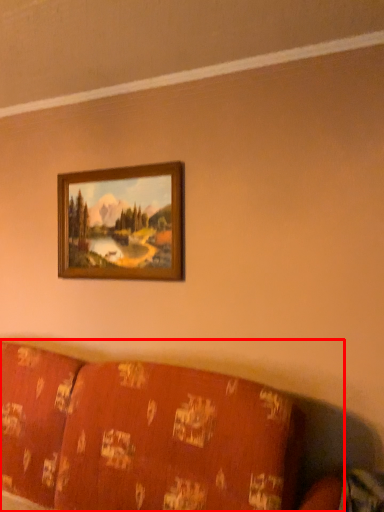
Question: From the image's perspective, considering the relative positions of furniture (annotated by the red box) and picture frame in the image provided, where is furniture (annotated by the red box) located with respect to the staircase?

Choices:
 (A) below
 (B) above

Answer: (A)